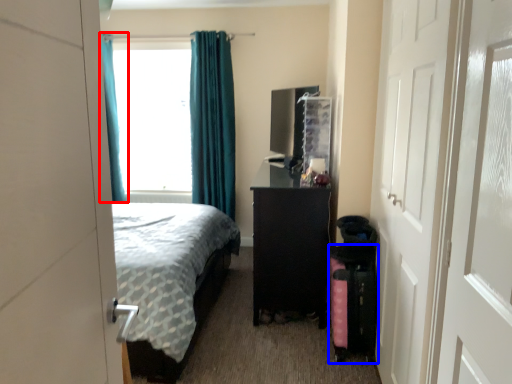
Question: Which point is further to the camera, curtain (highlighted by a red box) or luggage (highlighted by a blue box)?

Choices:
 (A) curtain
 (B) luggage

Answer: (A)